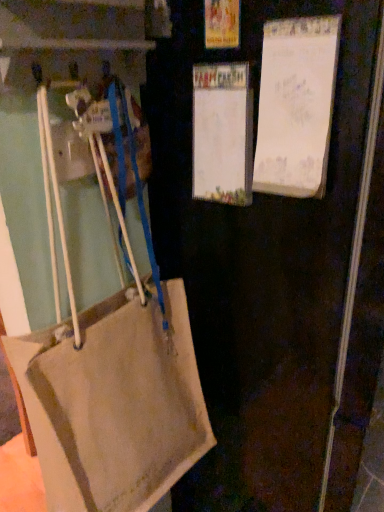
Question: From a real-world perspective, does white paper at center, which is counted as the 1th bulletin board, starting from the left, stand above white paper at upper right, acting as the second bulletin board starting from the left?

Choices:
 (A) yes
 (B) no

Answer: (B)

Question: Does white paper at center, which is counted as the 1th bulletin board, starting from the left, appear on the left side of white paper at upper right, which appears as the first bulletin board when viewed from the right?

Choices:
 (A) yes
 (B) no

Answer: (A)

Question: Is white paper at center, the 2th bulletin board viewed from the right, oriented towards white paper at upper right, which appears as the first bulletin board when viewed from the right?

Choices:
 (A) yes
 (B) no

Answer: (B)

Question: Considering the relative sizes of white paper at center, the 2th bulletin board viewed from the right, and white paper at upper right, acting as the second bulletin board starting from the left, in the image provided, is white paper at center, the 2th bulletin board viewed from the right, taller than white paper at upper right, acting as the second bulletin board starting from the left,?

Choices:
 (A) yes
 (B) no

Answer: (B)

Question: Can you confirm if white paper at center, which is counted as the 1th bulletin board, starting from the left, is thinner than white paper at upper right, which appears as the first bulletin board when viewed from the right?

Choices:
 (A) yes
 (B) no

Answer: (A)

Question: Would you say white paper at center, which is counted as the 1th bulletin board, starting from the left, is inside or outside beige canvas handbag at lower left?

Choices:
 (A) inside
 (B) outside

Answer: (A)

Question: Based on their sizes in the image, would you say white paper at center, the 2th bulletin board viewed from the right, is bigger or smaller than beige canvas handbag at lower left?

Choices:
 (A) big
 (B) small

Answer: (B)

Question: Based on their positions, is white paper at center, the 2th bulletin board viewed from the right, located to the left or right of beige canvas handbag at lower left?

Choices:
 (A) right
 (B) left

Answer: (A)

Question: Considering the positions of white paper at center, which is counted as the 1th bulletin board, starting from the left, and beige canvas handbag at lower left in the image, is white paper at center, which is counted as the 1th bulletin board, starting from the left, taller or shorter than beige canvas handbag at lower left?

Choices:
 (A) short
 (B) tall

Answer: (A)

Question: Which is correct: beige canvas handbag at lower left is inside beige fabric bag at left, or outside of it?

Choices:
 (A) inside
 (B) outside

Answer: (B)

Question: Based on their positions, is beige canvas handbag at lower left located to the left or right of beige fabric bag at left?

Choices:
 (A) right
 (B) left

Answer: (B)

Question: Is beige canvas handbag at lower left taller or shorter than beige fabric bag at left?

Choices:
 (A) tall
 (B) short

Answer: (B)

Question: Relative to beige fabric bag at left, is beige canvas handbag at lower left in front or behind?

Choices:
 (A) front
 (B) behind

Answer: (B)

Question: In the image, is white paper at upper right, which appears as the first bulletin board when viewed from the right, positioned in front of or behind beige canvas handbag at lower left?

Choices:
 (A) front
 (B) behind

Answer: (B)

Question: From the image's perspective, is white paper at upper right, which appears as the first bulletin board when viewed from the right, positioned above or below beige canvas handbag at lower left?

Choices:
 (A) above
 (B) below

Answer: (A)